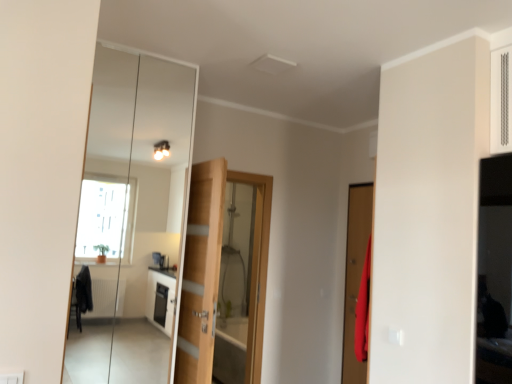
Question: Choose the correct answer: Is clear glass mirror at center inside matte wooden door at right, which is counted as the second door, starting from the back, or outside it?

Choices:
 (A) outside
 (B) inside

Answer: (A)

Question: From a real-world perspective, is clear glass mirror at center positioned above or below matte wooden door at right, which is counted as the first door, starting from the right?

Choices:
 (A) below
 (B) above

Answer: (B)

Question: Which object is the closest to the matte wooden door at right, which is counted as the first door, starting from the right?

Choices:
 (A) clear glass mirror at center
 (B) wooden door at center, the 2th door from the front

Answer: (B)

Question: Based on their relative distances, which object is nearer to the clear glass mirror at center?

Choices:
 (A) wooden door at center, positioned as the 2th door in right-to-left order
 (B) matte wooden door at right, which ranks as the second door in left-to-right order

Answer: (B)